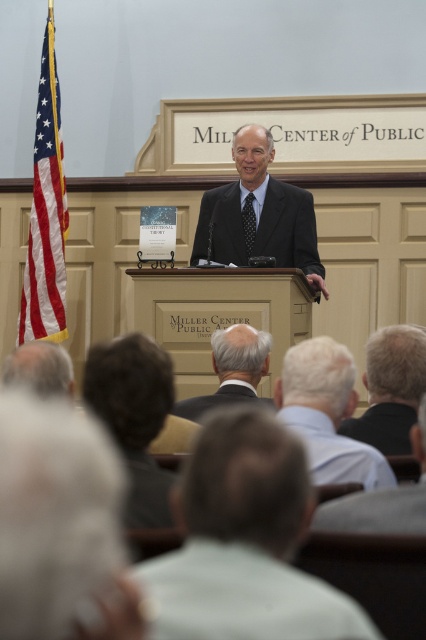
You are attending the event at the Miller Center of Public Affairs and want to know which of the two points, point (193, 451) or point (270, 216), is closer to you. Can you determine this based on the scene?

Point (193, 451) is closer to the viewer than point (270, 216).